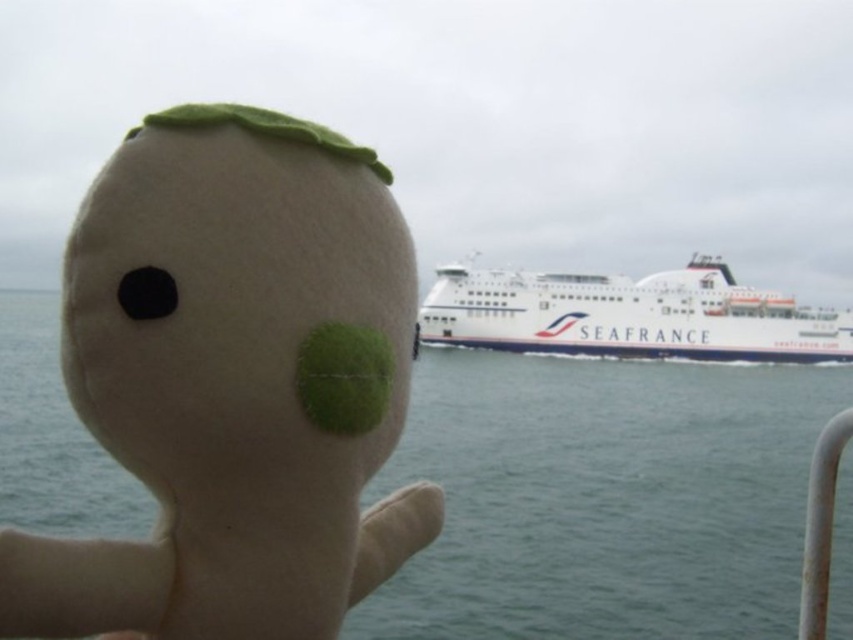
Question: Can you confirm if green felt water at center is bigger than white matte ferry at center?

Choices:
 (A) yes
 (B) no

Answer: (A)

Question: Among these objects, which one is farthest from the camera?

Choices:
 (A) white matte ferry at center
 (B) green felt water at center
 (C) felt toy at center

Answer: (A)

Question: Among these points, which one is farthest from the camera?

Choices:
 (A) (260, 628)
 (B) (796, 532)

Answer: (B)

Question: Does felt toy at center have a larger size compared to white matte ferry at center?

Choices:
 (A) no
 (B) yes

Answer: (A)

Question: Is green felt water at center above white matte ferry at center?

Choices:
 (A) yes
 (B) no

Answer: (B)

Question: Which of these objects is positioned closest to the white matte ferry at center?

Choices:
 (A) green felt water at center
 (B) felt toy at center

Answer: (A)